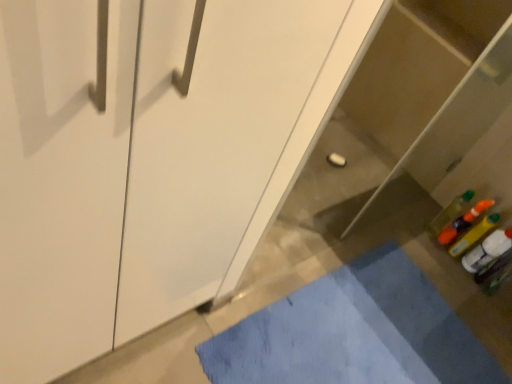
Question: Is blue fabric bath mat at lower center wider or thinner than translucent plastic bottle at lower right?

Choices:
 (A) wide
 (B) thin

Answer: (A)

Question: From a real-world perspective, is blue fabric bath mat at lower center above or below translucent plastic bottle at lower right?

Choices:
 (A) below
 (B) above

Answer: (A)

Question: Considering the real-world distances, which object is closest to the white glossy cabinet at center?

Choices:
 (A) translucent plastic bottle at lower right
 (B) blue fabric bath mat at lower center

Answer: (B)

Question: Which is nearer to the blue fabric bath mat at lower center?

Choices:
 (A) translucent plastic bottle at lower right
 (B) white glossy cabinet at center

Answer: (A)